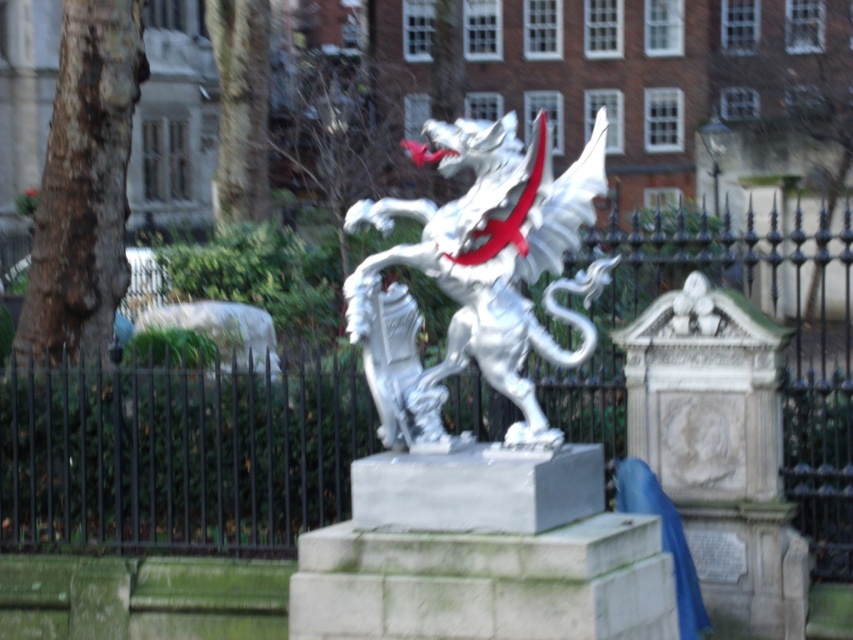
Question: Which point is closer to the camera?

Choices:
 (A) black metal fence at center
 (B) white marble dragon at center

Answer: (B)

Question: From the image, what is the correct spatial relationship of black metal fence at center in relation to white marble dragon at center?

Choices:
 (A) above
 (B) below

Answer: (B)

Question: Can you confirm if black metal fence at center is wider than white marble dragon at center?

Choices:
 (A) yes
 (B) no

Answer: (A)

Question: Observing the image, what is the correct spatial positioning of black metal fence at center in reference to white marble dragon at center?

Choices:
 (A) left
 (B) right

Answer: (B)